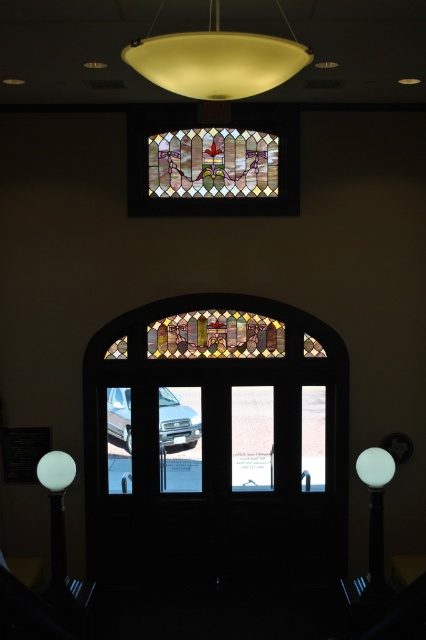
Question: Which of the following is the closest to the observer?

Choices:
 (A) (252, 384)
 (B) (62, 488)

Answer: (B)

Question: From the image, what is the correct spatial relationship of silver metallic car at center in relation to white glossy lamp post at lower left?

Choices:
 (A) right
 (B) left

Answer: (A)

Question: Where is translucent glass dome at upper center located in relation to silver metallic car at center in the image?

Choices:
 (A) below
 (B) above

Answer: (B)

Question: Does translucent glass dome at upper center have a lesser width compared to white glossy sphere at lower left?

Choices:
 (A) yes
 (B) no

Answer: (B)

Question: Which point is farther to the camera?

Choices:
 (A) silver metallic car at center
 (B) white glossy sphere at lower left

Answer: (A)

Question: Which object is positioned farthest from the stained glass window at center?

Choices:
 (A) white glossy sphere at lower left
 (B) white glossy lamp post at lower left

Answer: (A)